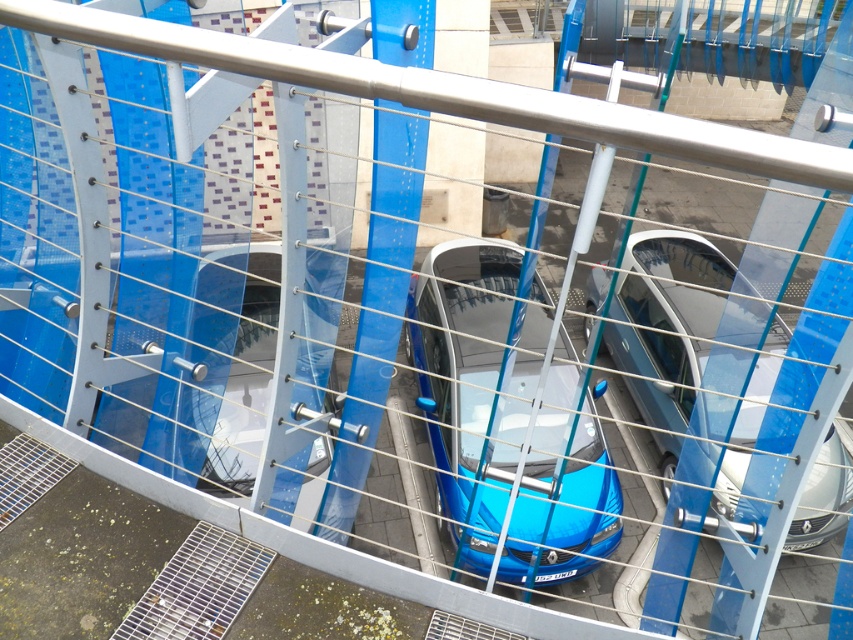
Is blue glossy car at center taller than glossy blue car at center?

Yes.

Does blue glossy car at center appear on the left side of glossy blue car at center?

Indeed, blue glossy car at center is positioned on the left side of glossy blue car at center.

Between point (480, 342) and point (833, 509), which one is positioned in front?

Point (833, 509) is more forward.

I want to click on blue glossy car at center, so click(508, 419).